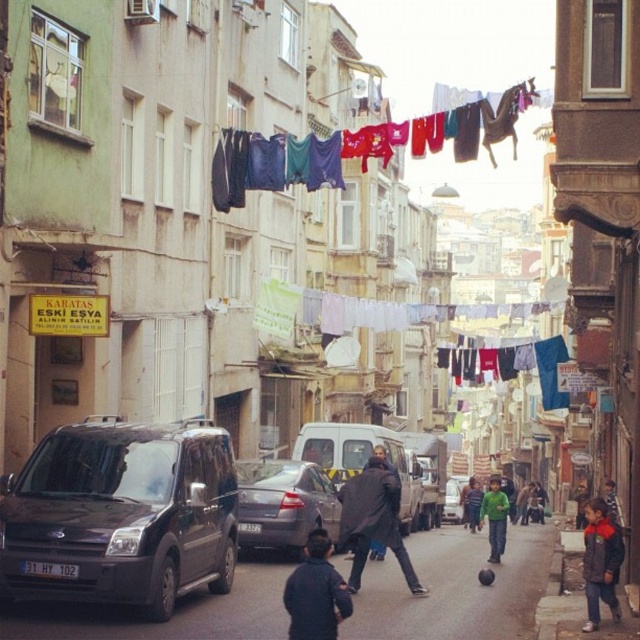
Question: Which object is closer to the camera taking this photo?

Choices:
 (A) green matte shirt at center
 (B) multicolored fabric clothesline at upper center
 (C) silver metallic van at center
 (D) dark blue jacket at center

Answer: (D)

Question: Which point is farther to the camera?

Choices:
 (A) (332, 621)
 (B) (456, 493)
 (C) (403, 144)
 (D) (360, 449)

Answer: (B)

Question: Which point is farther from the camera taking this photo?

Choices:
 (A) (301, 636)
 (B) (452, 486)

Answer: (B)

Question: Is matte black van at center-left thinner than matte gray car at center?

Choices:
 (A) no
 (B) yes

Answer: (A)

Question: Considering the relative positions of dark gray matte van at center and green cotton sweater at center in the image provided, where is dark gray matte van at center located with respect to green cotton sweater at center?

Choices:
 (A) right
 (B) left

Answer: (B)

Question: Does matte black van at left have a greater width compared to multicolored fabric clothesline at upper center?

Choices:
 (A) yes
 (B) no

Answer: (B)